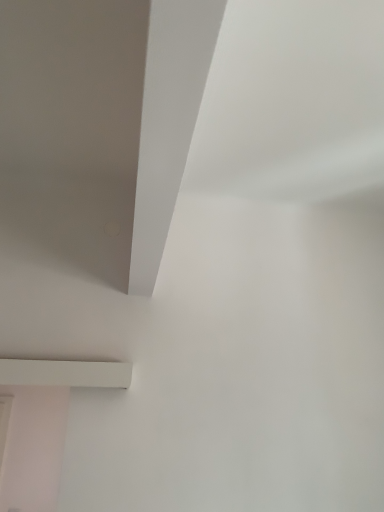
What do you see at coordinates (168, 122) in the screenshot? I see `white matte exhaust hood at center` at bounding box center [168, 122].

Where is `white matte exhaust hood at center`? This screenshot has height=512, width=384. white matte exhaust hood at center is located at coordinates (168, 122).

Where is `white matte exhaust hood at center`? The height and width of the screenshot is (512, 384). white matte exhaust hood at center is located at coordinates (168, 122).